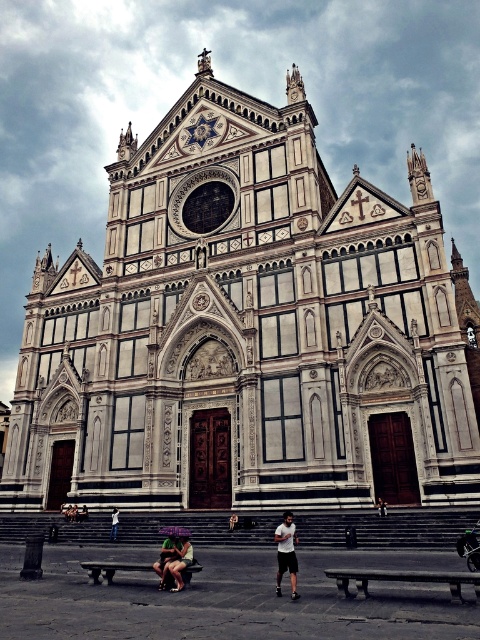
Question: Which point is farther from the camera taking this photo?

Choices:
 (A) (284, 141)
 (B) (288, 548)
 (C) (191, 566)

Answer: (A)

Question: Is wooden bench at lower center above matte black shorts at lower center?

Choices:
 (A) no
 (B) yes

Answer: (B)

Question: Which of the following is the closest to the observer?

Choices:
 (A) (164, 376)
 (B) (171, 536)
 (C) (168, 582)

Answer: (C)

Question: Is green fabric person at center thinner than light brown leather jacket at lower center?

Choices:
 (A) no
 (B) yes

Answer: (A)

Question: Can you confirm if wooden bench at center is positioned below light blue jeans at center?

Choices:
 (A) yes
 (B) no

Answer: (A)

Question: Which point is closer to the camera?

Choices:
 (A) white marble church at center
 (B) wooden bench at lower center
 (C) wooden bench at center

Answer: (B)